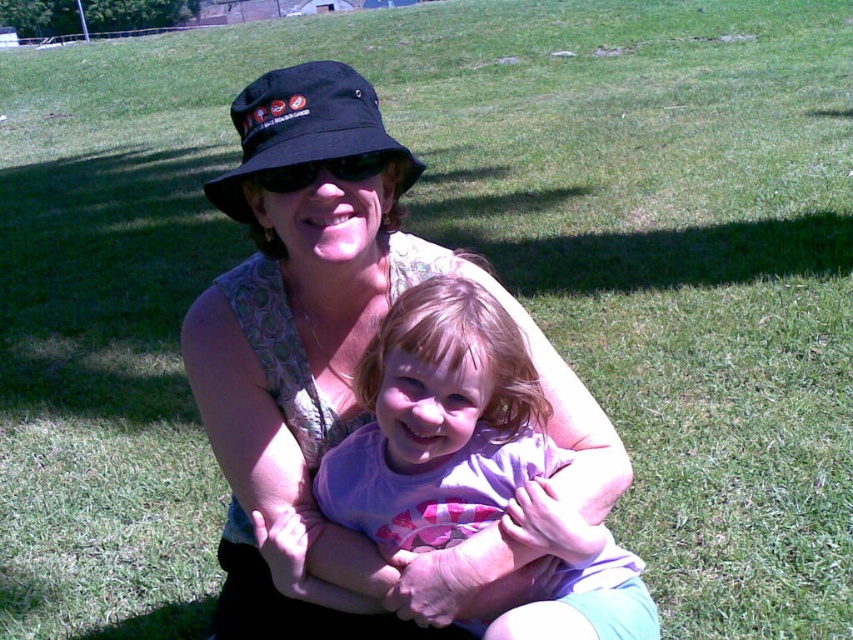
Question: Is purple cotton shirt at center to the left of black fabric hat at upper center from the viewer's perspective?

Choices:
 (A) no
 (B) yes

Answer: (A)

Question: Which point is farther from the camera taking this photo?

Choices:
 (A) (506, 451)
 (B) (271, 115)

Answer: (A)

Question: Is purple cotton shirt at center wider than black fabric hat at upper center?

Choices:
 (A) no
 (B) yes

Answer: (B)

Question: Which point is farther from the camera taking this photo?

Choices:
 (A) (212, 193)
 (B) (370, 449)

Answer: (B)

Question: Does purple cotton shirt at center appear under black fabric hat at upper center?

Choices:
 (A) yes
 (B) no

Answer: (A)

Question: Which object appears closest to the camera in this image?

Choices:
 (A) purple cotton shirt at center
 (B) black fabric hat at upper center

Answer: (A)